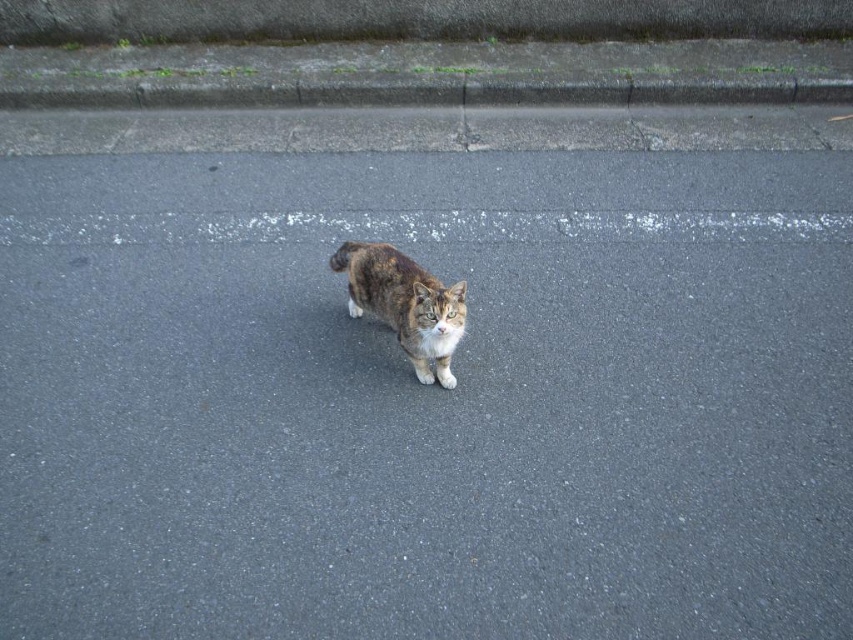
Question: Which object is closer to the camera taking this photo?

Choices:
 (A) gray concrete curb at upper center
 (B) tabby fur cat at center

Answer: (B)

Question: In this image, where is gray concrete curb at upper center located relative to tabby fur cat at center?

Choices:
 (A) above
 (B) below

Answer: (A)

Question: From the image, what is the correct spatial relationship of gray concrete curb at upper center in relation to tabby fur cat at center?

Choices:
 (A) right
 (B) left

Answer: (A)

Question: Which object is closer to the camera taking this photo?

Choices:
 (A) gray concrete curb at upper center
 (B) tabby fur cat at center

Answer: (B)

Question: Does gray concrete curb at upper center appear under tabby fur cat at center?

Choices:
 (A) no
 (B) yes

Answer: (A)